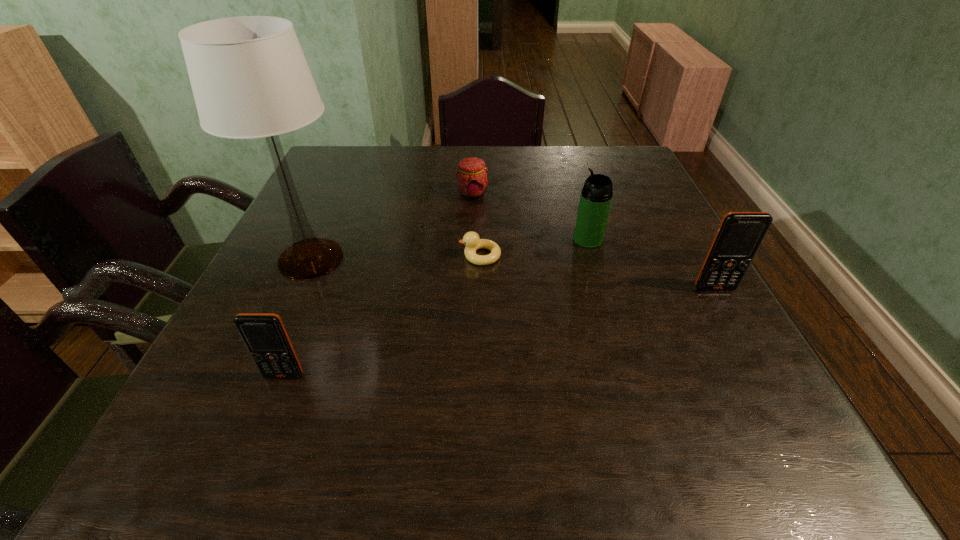
The width and height of the screenshot is (960, 540). In order to click on vacant space that's between the tallest object and the shorter cellular telephone in this screenshot , I will do `click(298, 317)`.

Locate an element on the screen. vacant region between the tallest object and the right cellular telephone is located at coordinates (513, 274).

Image resolution: width=960 pixels, height=540 pixels. I want to click on empty space between the farther cellular telephone and the thermos bottle, so click(x=651, y=264).

This screenshot has width=960, height=540. Find the location of `vacant point located between the thermos bottle and the duckling`. vacant point located between the thermos bottle and the duckling is located at coordinates (534, 248).

I want to click on free space between the duckling and the farthest object, so click(x=476, y=225).

Image resolution: width=960 pixels, height=540 pixels. Identify the location of vacant space in between the thermos bottle and the nearer cellular telephone. (436, 307).

Locate an element on the screen. Image resolution: width=960 pixels, height=540 pixels. free point between the shortest object and the jam is located at coordinates pos(476,225).

Find the location of a particular element. This screenshot has height=540, width=960. object that is the third closest one to the fifth object from left to right is located at coordinates (472, 182).

Identify which object is the fifth nearest to the fifth object from left to right. Please provide its 2D coordinates. Your answer should be formatted as a tuple, i.e. [(x, y)], where the tuple contains the x and y coordinates of a point satisfying the conditions above.

[(264, 334)]